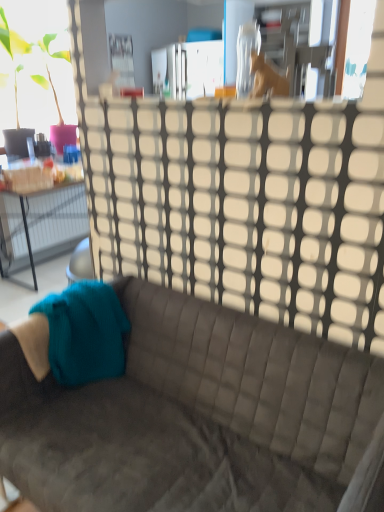
Question: Is teal knitted fabric at lower left next to suede gray couch at center and touching it?

Choices:
 (A) yes
 (B) no

Answer: (B)

Question: Does teal knitted fabric at lower left lie in front of suede gray couch at center?

Choices:
 (A) yes
 (B) no

Answer: (B)

Question: Is teal knitted fabric at lower left thinner than suede gray couch at center?

Choices:
 (A) no
 (B) yes

Answer: (B)

Question: From the image's perspective, is teal knitted fabric at lower left located beneath suede gray couch at center?

Choices:
 (A) yes
 (B) no

Answer: (B)

Question: Can you confirm if teal knitted fabric at lower left is shorter than suede gray couch at center?

Choices:
 (A) yes
 (B) no

Answer: (A)

Question: Is the depth of teal knitted fabric at lower left greater than that of suede gray couch at center?

Choices:
 (A) no
 (B) yes

Answer: (B)

Question: Does suede gray couch at center appear on the right side of wooden horse at upper center?

Choices:
 (A) no
 (B) yes

Answer: (A)

Question: Is the position of suede gray couch at center more distant than that of wooden horse at upper center?

Choices:
 (A) no
 (B) yes

Answer: (A)

Question: Does suede gray couch at center have a lesser width compared to wooden horse at upper center?

Choices:
 (A) no
 (B) yes

Answer: (A)

Question: Is suede gray couch at center to the left of wooden horse at upper center from the viewer's perspective?

Choices:
 (A) yes
 (B) no

Answer: (A)

Question: From the image's perspective, is suede gray couch at center over wooden horse at upper center?

Choices:
 (A) yes
 (B) no

Answer: (B)

Question: From a real-world perspective, does suede gray couch at center sit lower than wooden horse at upper center?

Choices:
 (A) no
 (B) yes

Answer: (B)

Question: Is wooden horse at upper center wider than teal knitted fabric at lower left?

Choices:
 (A) yes
 (B) no

Answer: (B)